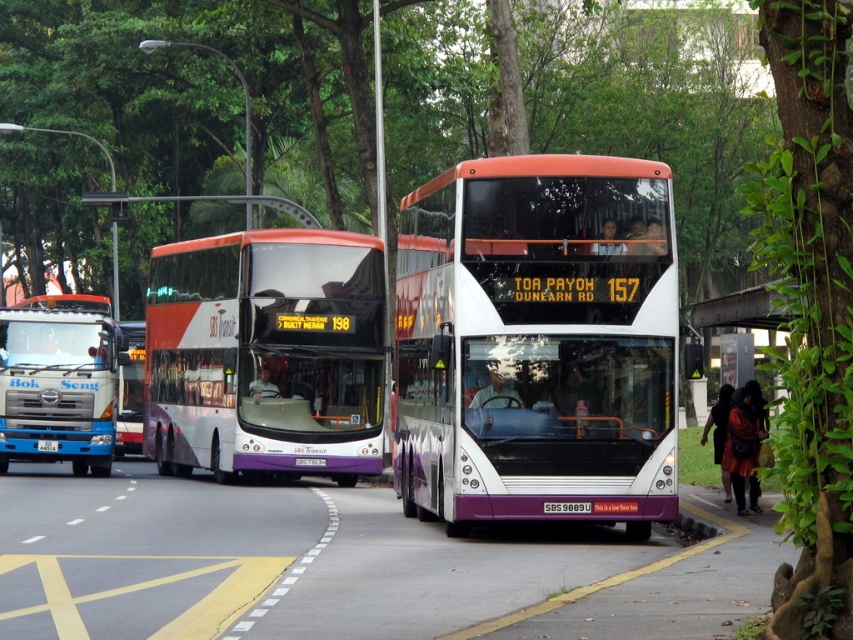
Question: Can you confirm if purple plastic license plate at center is positioned below black plastic license plate at center?

Choices:
 (A) no
 (B) yes

Answer: (A)

Question: Does metallic silver bus stop at right appear on the right side of purple plastic license plate at center?

Choices:
 (A) no
 (B) yes

Answer: (B)

Question: Can you confirm if purple plastic license plate at center is bigger than black plastic license plate at center?

Choices:
 (A) yes
 (B) no

Answer: (B)

Question: Which point appears closest to the camera in this image?

Choices:
 (A) (38, 442)
 (B) (227, 349)
 (C) (567, 513)
 (D) (9, 458)

Answer: (C)

Question: Which object is positioned closest to the metallic silver bus stop at right?

Choices:
 (A) purple plastic license plate at center
 (B) black plastic license plate at center
 (C) blue metallic truck at left
 (D) matte purple bus at center

Answer: (A)

Question: Among these objects, which one is nearest to the camera?

Choices:
 (A) white glossy bus at center
 (B) black plastic license plate at center

Answer: (A)